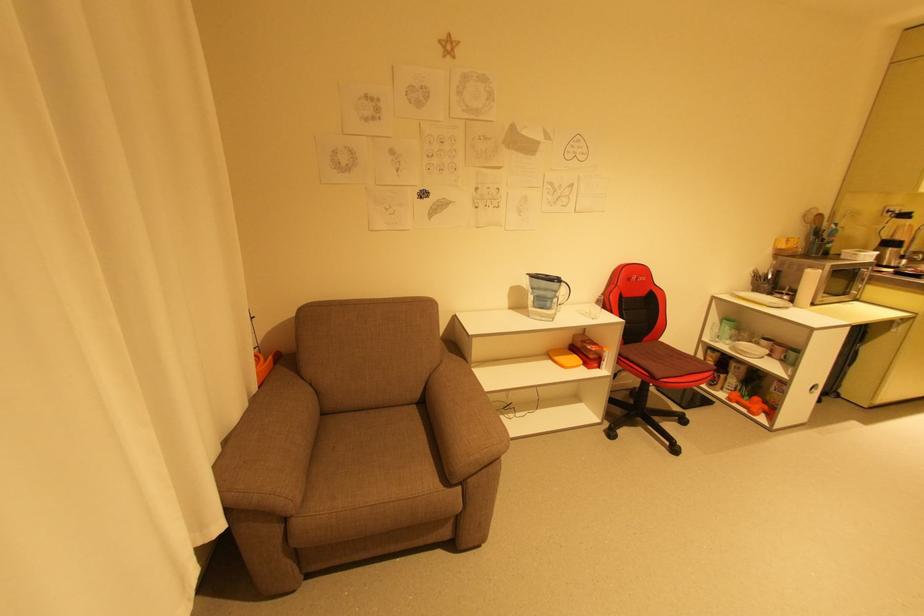
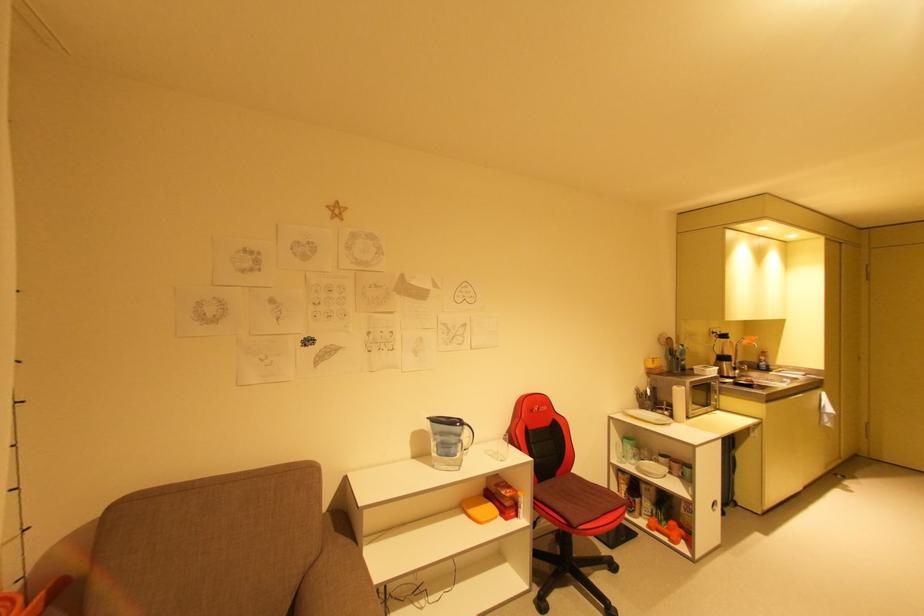
Where in the second image is the point corresponding to pixel 845 386 from the first image?

(737, 493)